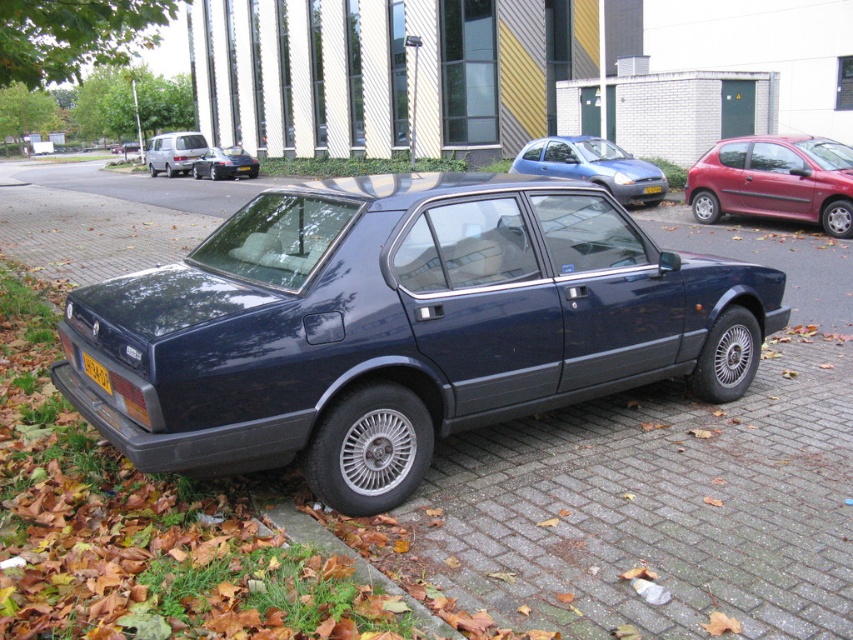
Can you confirm if satin dark blue sedan at center is wider than matte blue sedan at center?

Yes.

Can you confirm if satin dark blue sedan at center is positioned below matte blue sedan at center?

Yes, satin dark blue sedan at center is below matte blue sedan at center.

Between point (467, 339) and point (517, 168), which one is positioned behind?

The point (517, 168) is more distant.

Find the location of `satin dark blue sedan at center`. satin dark blue sedan at center is located at coordinates (399, 326).

Is point (378, 205) behind point (192, 144)?

No, it is in front of (192, 144).

Which is behind, point (375, 432) or point (163, 138)?

Point (163, 138)

Locate an element on the screen. This screenshot has height=640, width=853. satin dark blue sedan at center is located at coordinates (399, 326).

This screenshot has width=853, height=640. What do you see at coordinates (593, 166) in the screenshot?
I see `matte blue sedan at center` at bounding box center [593, 166].

Is the position of matte blue sedan at center less distant than that of glossy black sedan at center?

Yes, it is.

Locate an element on the screen. The height and width of the screenshot is (640, 853). matte blue sedan at center is located at coordinates (593, 166).